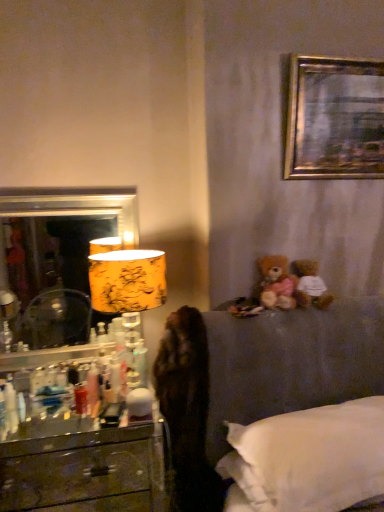
Question: Considering the relative sizes of white plush teddy bear at upper right, the second teddy bear positioned from the left, and fuzzy brown teddy bear at left in the image provided, is white plush teddy bear at upper right, the second teddy bear positioned from the left, wider than fuzzy brown teddy bear at left?

Choices:
 (A) yes
 (B) no

Answer: (B)

Question: Is white plush teddy bear at upper right, the second teddy bear positioned from the left, bigger than fuzzy brown teddy bear at left?

Choices:
 (A) no
 (B) yes

Answer: (A)

Question: Can you confirm if white plush teddy bear at upper right, the second teddy bear positioned from the left, is positioned to the right of fuzzy brown teddy bear at left?

Choices:
 (A) no
 (B) yes

Answer: (B)

Question: From a real-world perspective, is white plush teddy bear at upper right, the second teddy bear positioned from the left, under fuzzy brown teddy bear at left?

Choices:
 (A) yes
 (B) no

Answer: (B)

Question: Is white plush teddy bear at upper right, marked as the first teddy bear in a right-to-left arrangement, behind fuzzy brown teddy bear at left?

Choices:
 (A) no
 (B) yes

Answer: (B)

Question: Is yellow floral fabric lampshade at left in front of or behind white soft pillow at lower right in the image?

Choices:
 (A) behind
 (B) front

Answer: (A)

Question: Is yellow floral fabric lampshade at left bigger or smaller than white soft pillow at lower right?

Choices:
 (A) small
 (B) big

Answer: (A)

Question: Is yellow floral fabric lampshade at left to the left or to the right of white soft pillow at lower right in the image?

Choices:
 (A) left
 (B) right

Answer: (A)

Question: Is point (100, 306) positioned closer to the camera than point (276, 505)?

Choices:
 (A) closer
 (B) farther

Answer: (B)

Question: Is point (309, 260) closer or farther from the camera than point (286, 303)?

Choices:
 (A) closer
 (B) farther

Answer: (B)

Question: Considering their positions, is white plush teddy bear at upper right, marked as the first teddy bear in a right-to-left arrangement, located in front of or behind brown plush teddy bear at upper right, acting as the first teddy bear starting from the left?

Choices:
 (A) front
 (B) behind

Answer: (B)

Question: In terms of size, does white plush teddy bear at upper right, the second teddy bear positioned from the left, appear bigger or smaller than brown plush teddy bear at upper right, acting as the first teddy bear starting from the left?

Choices:
 (A) big
 (B) small

Answer: (A)

Question: Would you say white plush teddy bear at upper right, the second teddy bear positioned from the left, is to the left or to the right of brown plush teddy bear at upper right, acting as the first teddy bear starting from the left, in the picture?

Choices:
 (A) right
 (B) left

Answer: (A)

Question: Is wooden drawer at lower left spatially inside brown plush teddy bear at upper right, marked as the 2th teddy bear in a right-to-left arrangement, or outside of it?

Choices:
 (A) inside
 (B) outside

Answer: (B)

Question: Looking at their shapes, would you say wooden drawer at lower left is wider or thinner than brown plush teddy bear at upper right, acting as the first teddy bear starting from the left?

Choices:
 (A) wide
 (B) thin

Answer: (B)